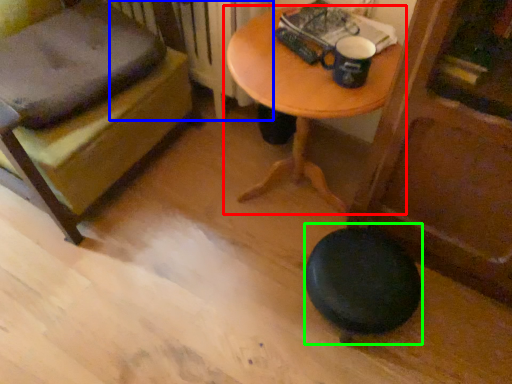
Question: Estimate the real-world distances between objects in this image. Which object is closer to table (highlighted by a red box), radiator (highlighted by a blue box) or stool (highlighted by a green box)?

Choices:
 (A) radiator
 (B) stool

Answer: (A)